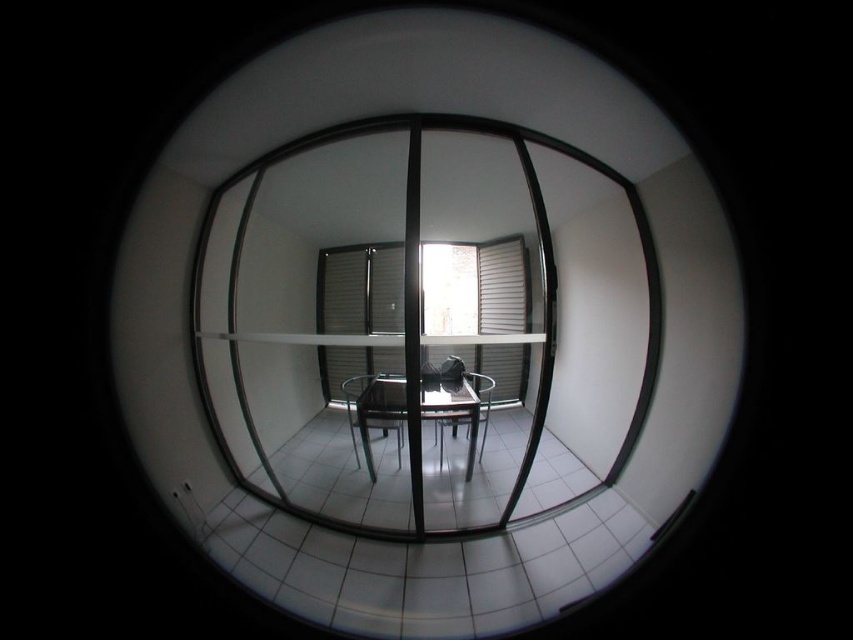
Question: From the image, what is the correct spatial relationship of transparent glass mirror at center in relation to matte gray window at center?

Choices:
 (A) above
 (B) below

Answer: (B)

Question: Which point is closer to the camera taking this photo?

Choices:
 (A) (511, 310)
 (B) (483, 128)
 (C) (479, 406)

Answer: (A)

Question: In this image, where is metallic black chair at center located relative to metallic silver chair at center?

Choices:
 (A) above
 (B) below

Answer: (B)

Question: Which point appears farthest from the camera in this image?

Choices:
 (A) (242, 168)
 (B) (399, 451)
 (C) (469, 316)

Answer: (A)

Question: Among these points, which one is farthest from the camera?

Choices:
 (A) (351, 428)
 (B) (413, 332)
 (C) (368, 451)
 (D) (473, 458)

Answer: (D)

Question: In this image, where is transparent glass mirror at center located relative to matte gray window at center?

Choices:
 (A) above
 (B) below

Answer: (B)